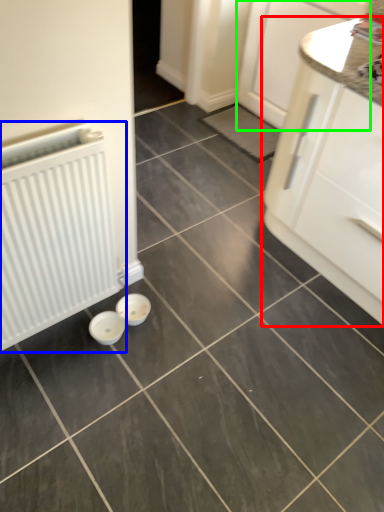
Question: Which object is the closest to the cabinetry (highlighted by a red box)? Choose among these: radiator (highlighted by a blue box) or cabinetry (highlighted by a green box).

Choices:
 (A) radiator
 (B) cabinetry

Answer: (B)